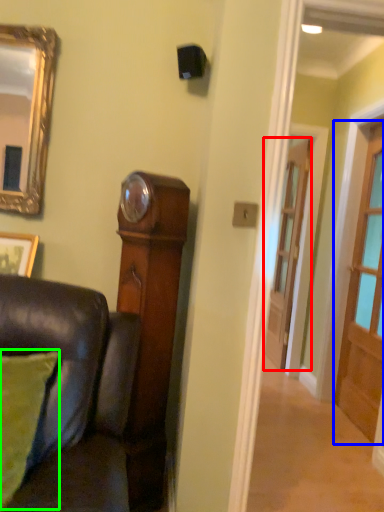
Question: Based on their relative distances, which object is farther from door (highlighted by a red box)? Choose from door (highlighted by a blue box) and pillow (highlighted by a green box).

Choices:
 (A) door
 (B) pillow

Answer: (B)